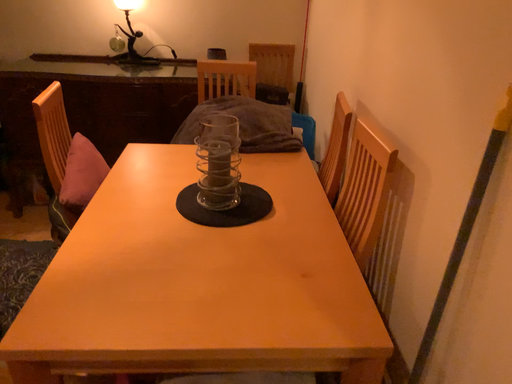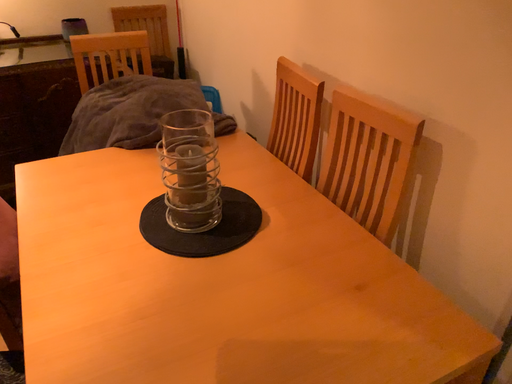
Question: Which way did the camera rotate in the video?

Choices:
 (A) rotated left
 (B) rotated right

Answer: (B)